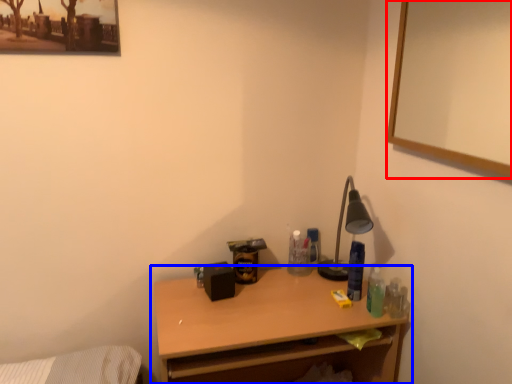
Question: Which object appears closest to the camera in this image, picture frame (highlighted by a red box) or desk (highlighted by a blue box)?

Choices:
 (A) picture frame
 (B) desk

Answer: (A)